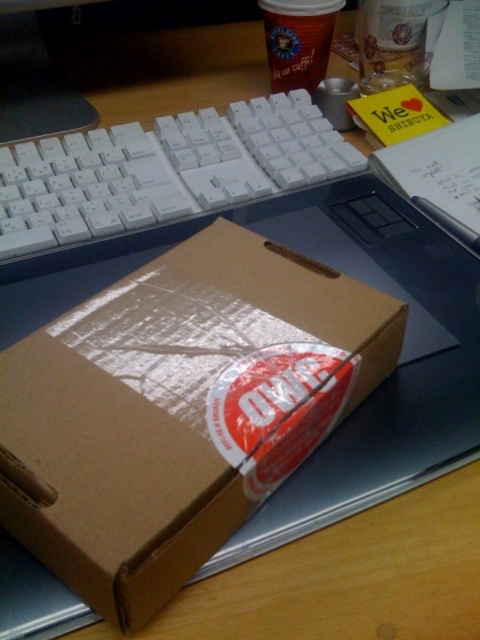
Question: Observing the image, what is the correct spatial positioning of brown cardboard box at center in reference to white plastic keyboard at center?

Choices:
 (A) right
 (B) left

Answer: (A)

Question: Which point is farther to the camera?

Choices:
 (A) (165, 154)
 (B) (220, 428)

Answer: (A)

Question: Which point is closer to the camera?

Choices:
 (A) brown cardboard box at center
 (B) white plastic keyboard at center

Answer: (A)

Question: Can you confirm if brown cardboard box at center is bigger than white plastic keyboard at center?

Choices:
 (A) no
 (B) yes

Answer: (A)

Question: Can you confirm if brown cardboard box at center is smaller than white plastic keyboard at center?

Choices:
 (A) no
 (B) yes

Answer: (B)